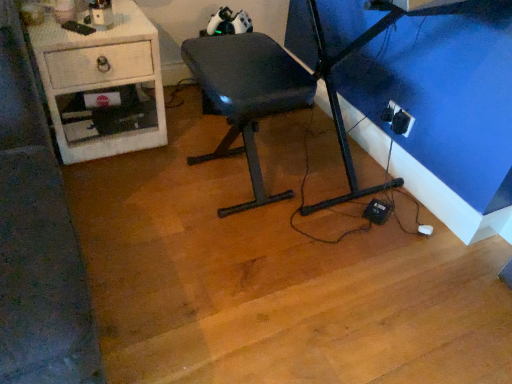
At what (x,y) coordinates should I click in order to perform the action: click on vacant space in between white glossy desk at left and matte black chair at center. Please return your answer as a coordinate pair (x, y). Looking at the image, I should click on (162, 163).